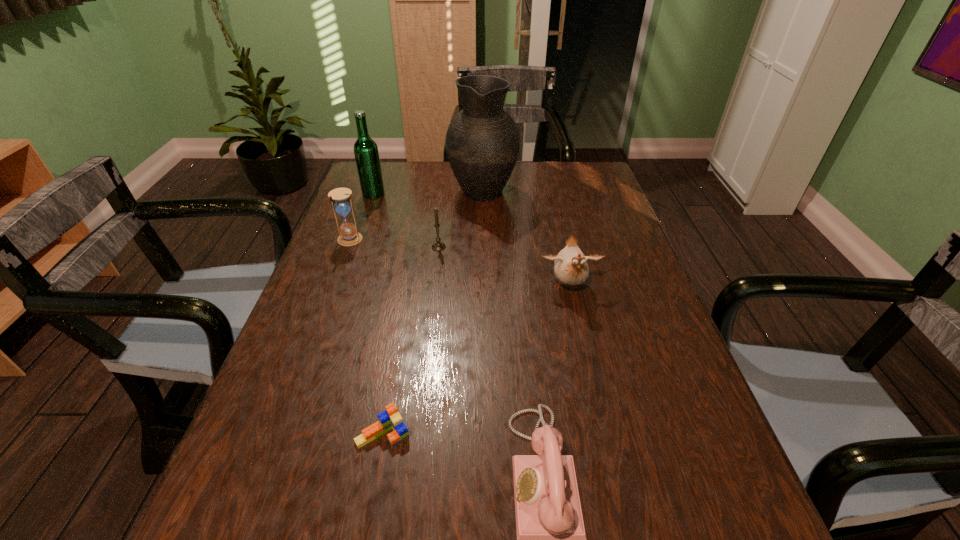
Locate an element on the screen. The width and height of the screenshot is (960, 540). free region at the left edge is located at coordinates (370, 279).

At what (x,y) coordinates should I click in order to perform the action: click on free location at the right edge of the desktop. Please return your answer as a coordinate pair (x, y). This screenshot has width=960, height=540. Looking at the image, I should click on (696, 457).

Where is `vacant space at the far right corner of the desktop`? vacant space at the far right corner of the desktop is located at coordinates (573, 186).

Where is `vacant space in between the shortest object and the candle`? vacant space in between the shortest object and the candle is located at coordinates (411, 340).

The image size is (960, 540). Find the location of `free point between the second tallest object and the fifth farthest object`. free point between the second tallest object and the fifth farthest object is located at coordinates 471,240.

Where is `unoccupied position between the hourglass and the beer bottle`? unoccupied position between the hourglass and the beer bottle is located at coordinates click(362, 217).

This screenshot has height=540, width=960. Identify the location of blank region between the third nearest object and the tallest object. [x=526, y=239].

The image size is (960, 540). Identify the location of free space that is in between the candle and the Lego. (411, 340).

Locate an element on the screen. free space that is in between the candle and the shortest object is located at coordinates (411, 340).

Image resolution: width=960 pixels, height=540 pixels. I want to click on the fifth closest object to the candle, so click(390, 418).